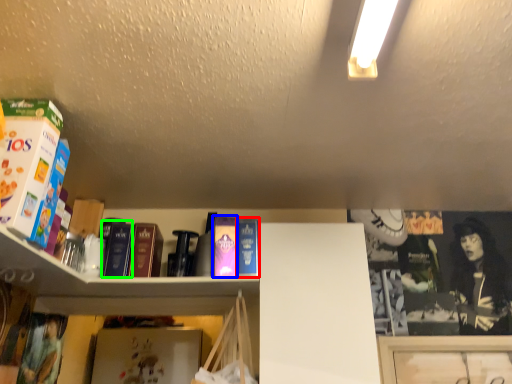
Question: Estimate the real-world distances between objects in this image. Which object is closer to paperback book (highlighted by a red box), paperback book (highlighted by a blue box) or book (highlighted by a green box)?

Choices:
 (A) paperback book
 (B) book

Answer: (A)